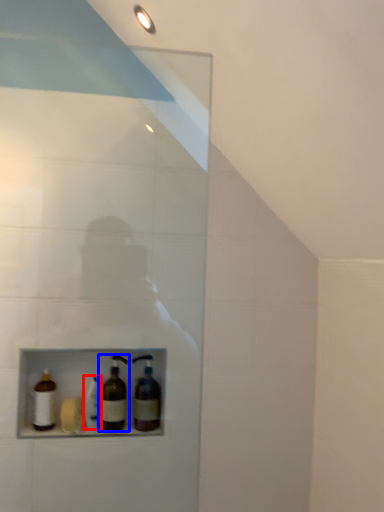
Question: Which of the following is the farthest to the observer, bottle (highlighted by a red box) or bottle (highlighted by a blue box)?

Choices:
 (A) bottle
 (B) bottle

Answer: (A)